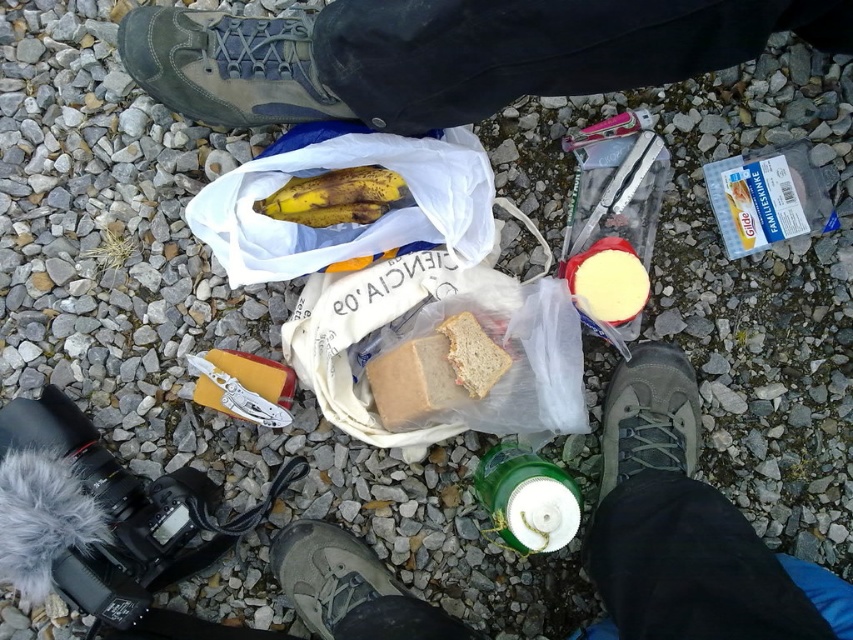
Does brown suede boot at upper center have a greater width compared to gray fabric shoe at lower right?

Indeed, brown suede boot at upper center has a greater width compared to gray fabric shoe at lower right.

What do you see at coordinates (227, 67) in the screenshot? The height and width of the screenshot is (640, 853). I see `brown suede boot at upper center` at bounding box center [227, 67].

Where is `brown suede boot at upper center`? The height and width of the screenshot is (640, 853). brown suede boot at upper center is located at coordinates (227, 67).

Based on the photo, is green plastic bottle at center positioned in front of yellow cheese at center?

Yes, green plastic bottle at center is in front of yellow cheese at center.

Who is positioned more to the right, green plastic bottle at center or yellow cheese at center?

yellow cheese at center is more to the right.

Does point (554, 476) come behind point (634, 275)?

No.

Where is `green plastic bottle at center`? green plastic bottle at center is located at coordinates (527, 499).

Does yellowish-brown peel banana at center have a larger size compared to slightly toasted bread at center?

Correct, yellowish-brown peel banana at center is larger in size than slightly toasted bread at center.

How distant is yellowish-brown peel banana at center from slightly toasted bread at center?

yellowish-brown peel banana at center is 11.30 inches from slightly toasted bread at center.

Between point (334, 176) and point (457, 372), which one is positioned in front?

Point (457, 372) is more forward.

The width and height of the screenshot is (853, 640). I want to click on yellowish-brown peel banana at center, so click(x=335, y=196).